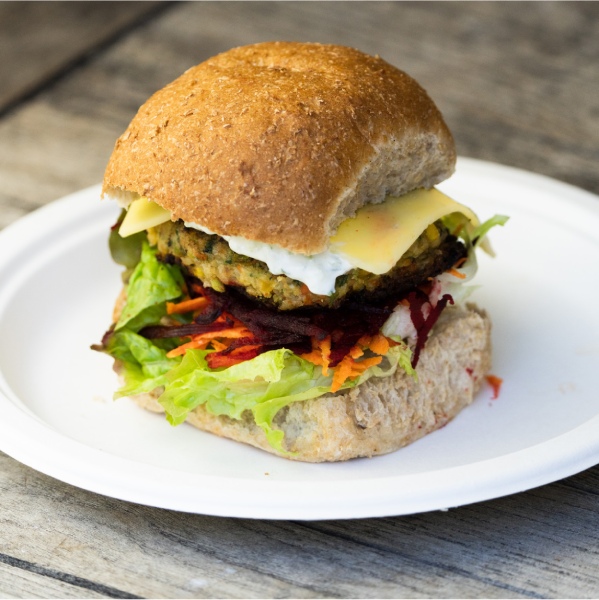
The height and width of the screenshot is (600, 599). I want to click on plate, so click(547, 376).